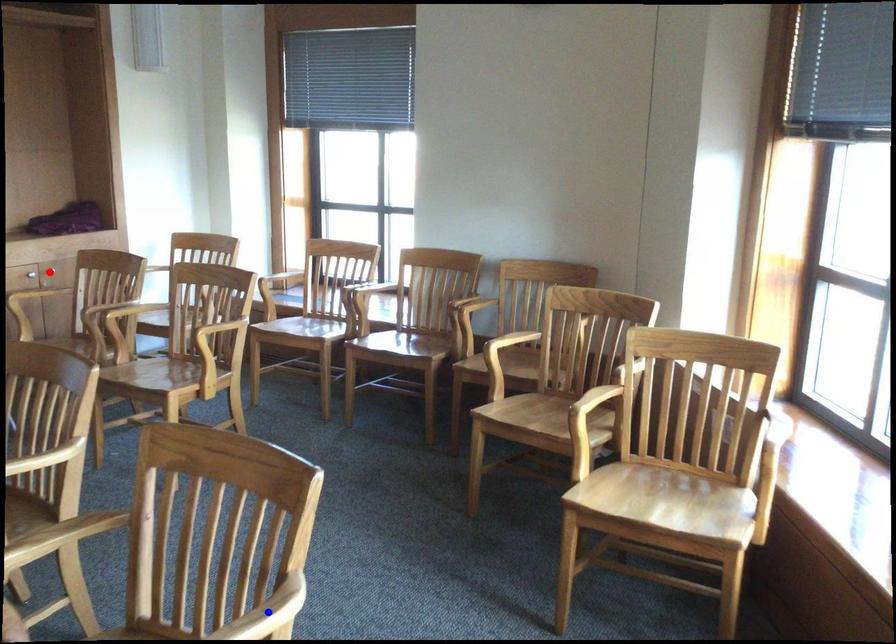
Question: Two points are marked on the image. Which point is closer to the camera?

Choices:
 (A) Blue point is closer.
 (B) Red point is closer.

Answer: (A)